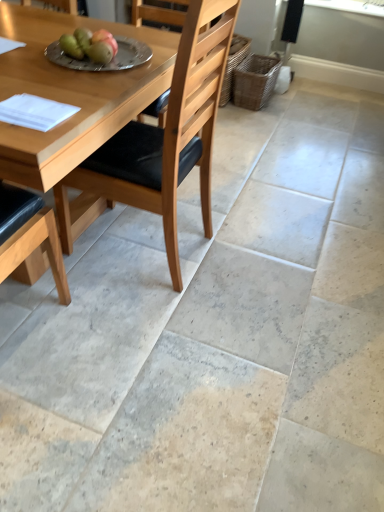
At what (x,y) coordinates should I click in order to perform the action: click on vacant location behind silver metallic plate at upper center. Please return your answer as a coordinate pair (x, y). The height and width of the screenshot is (512, 384). Looking at the image, I should click on click(x=126, y=33).